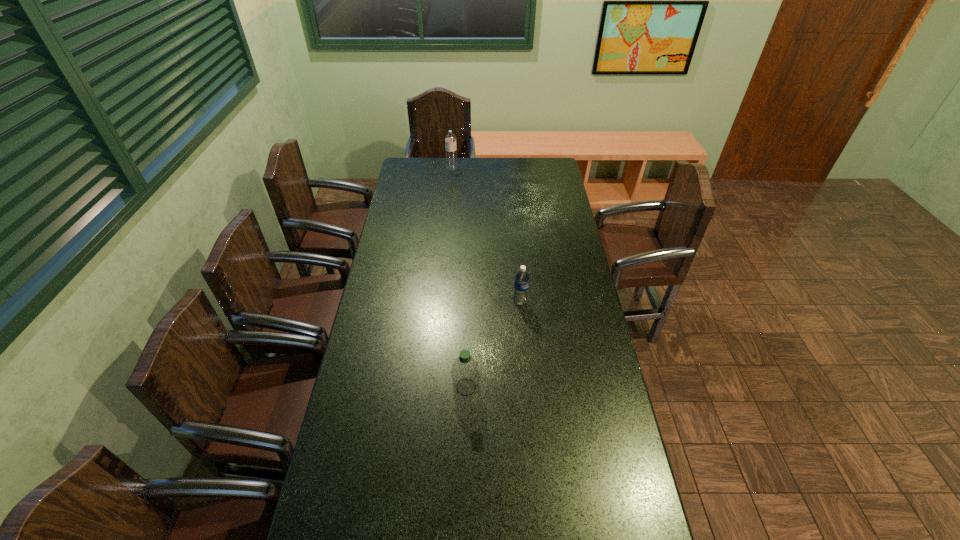
Locate an element on the screen. vacant space at the far edge of the desktop is located at coordinates (492, 174).

In the image, there is a desktop. Find the location of `vacant region at the left edge`. vacant region at the left edge is located at coordinates (427, 202).

The height and width of the screenshot is (540, 960). In the image, there is a desktop. What are the coordinates of `vacant space at the right edge` in the screenshot? It's located at (587, 327).

In the image, there is a desktop. Identify the location of vacant area at the far left corner. (434, 162).

In the image, there is a desktop. At what (x,y) coordinates should I click in order to perform the action: click on blank space at the far right corner. Please return your answer as a coordinate pair (x, y). The width and height of the screenshot is (960, 540). Looking at the image, I should click on (558, 179).

At what (x,y) coordinates should I click in order to perform the action: click on vacant region between the nearest water bottle and the second farthest object. Please return your answer as a coordinate pair (x, y). The image size is (960, 540). Looking at the image, I should click on (493, 345).

You are a GUI agent. You are given a task and a screenshot of the screen. Output one action in this format:
    pyautogui.click(x=<x>, y=<y>)
    Task: Click on the free spot between the tallest object and the second nearest water bottle
    
    Given the screenshot: What is the action you would take?
    pyautogui.click(x=486, y=235)

Locate an element on the screen. Image resolution: width=960 pixels, height=540 pixels. blank region between the second object from right to left and the tallest object is located at coordinates (459, 278).

Locate an element on the screen. empty location between the leftmost water bottle and the second object from right to left is located at coordinates pyautogui.click(x=459, y=278).

The image size is (960, 540). Identify the location of the closest object to the tallest object. (521, 284).